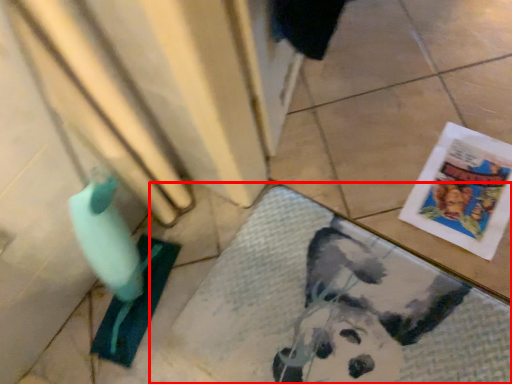
Question: From the image's perspective, what is the correct spatial relationship of bath mat (annotated by the red box) in relation to comic book?

Choices:
 (A) below
 (B) above

Answer: (A)